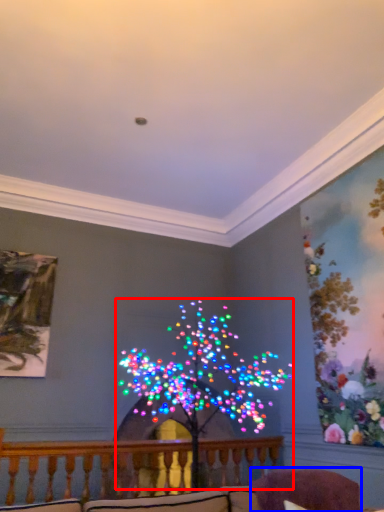
Question: Which object is further to the camera taking this photo, christmas decoration (highlighted by a red box) or swivel chair (highlighted by a blue box)?

Choices:
 (A) christmas decoration
 (B) swivel chair

Answer: (A)